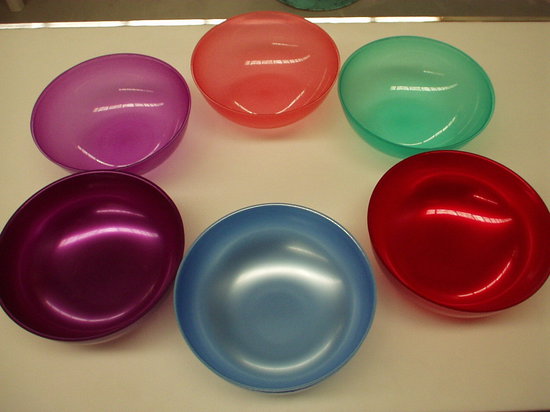
The image size is (550, 412). I want to click on table, so click(223, 166), click(429, 366), click(154, 376).